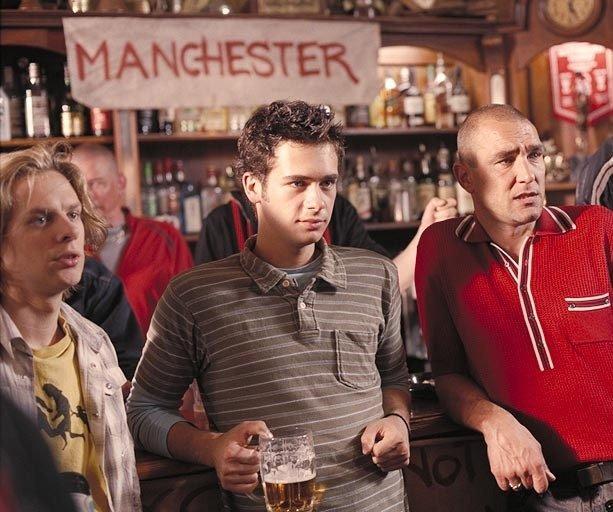
Find the location of a particular element. The image size is (613, 512). clock is located at coordinates (557, 17).